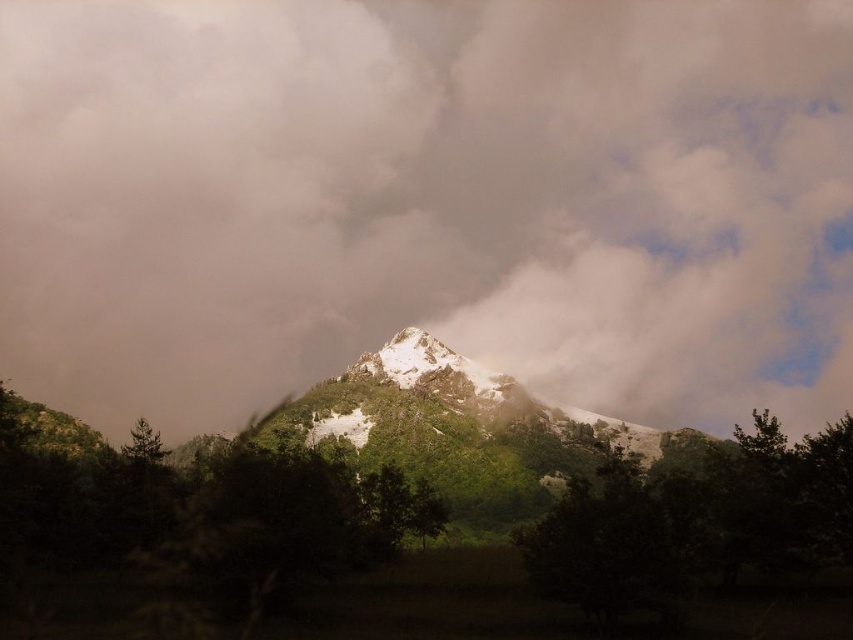
Does white fluffy cloud at center have a lesser width compared to green leafy tree at center?

No.

Which is more to the left, white fluffy cloud at center or green leafy tree at center?

Positioned to the left is white fluffy cloud at center.

Which is in front, point (262, 326) or point (599, 531)?

Point (599, 531) is more forward.

Find the location of `white fluffy cloud at center`. white fluffy cloud at center is located at coordinates tap(426, 200).